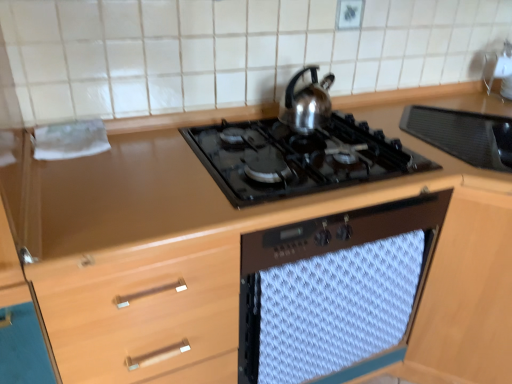
You are a GUI agent. You are given a task and a screenshot of the screen. Output one action in this format:
    pyautogui.click(x=<x>, y=<y>)
    Task: Click on the satin silver kettle at upper center
    This screenshot has width=512, height=384.
    Given the screenshot: What is the action you would take?
    pyautogui.click(x=307, y=103)

How different are the orientations of black glass gas stove at center and white textured towel at center in degrees?

0.00116 degrees separate the facing orientations of black glass gas stove at center and white textured towel at center.

Can you confirm if black glass gas stove at center is smaller than white textured towel at center?

Incorrect, black glass gas stove at center is not smaller in size than white textured towel at center.

Which of these two, black glass gas stove at center or white textured towel at center, is wider?

black glass gas stove at center.

Which is more to the left, white textured towel at center or satin silver kettle at upper center?

satin silver kettle at upper center.

From a real-world perspective, is white textured towel at center below satin silver kettle at upper center?

Yes, from a real-world perspective, white textured towel at center is under satin silver kettle at upper center.

Is white textured towel at center located outside satin silver kettle at upper center?

That's correct, white textured towel at center is outside of satin silver kettle at upper center.

In order to click on kitchen appliance on the left side of white textured towel at center in this screenshot , I will do `click(307, 103)`.

From the image's perspective, between satin silver kettle at upper center and white textured towel at center, which one is located above?

satin silver kettle at upper center is shown above in the image.

Consider the image. How distant is satin silver kettle at upper center from white textured towel at center?

satin silver kettle at upper center and white textured towel at center are 18.82 inches apart.

In terms of width, does satin silver kettle at upper center look wider or thinner when compared to white textured towel at center?

satin silver kettle at upper center is wider than white textured towel at center.

Is black glass gas stove at center oriented away from satin silver kettle at upper center?

No, black glass gas stove at center is not facing away from satin silver kettle at upper center.

Between black glass gas stove at center and satin silver kettle at upper center, which one has larger size?

black glass gas stove at center is bigger.

What's the angular difference between black glass gas stove at center and satin silver kettle at upper center's facing directions?

black glass gas stove at center and satin silver kettle at upper center are facing 0.00112 degrees away from each other.

Which object is closer to the camera taking this photo, black glass gas stove at center or satin silver kettle at upper center?

black glass gas stove at center is in front.

Consider the image. From a real-world perspective, is satin silver kettle at upper center above or below black glass gas stove at center?

satin silver kettle at upper center is above black glass gas stove at center.

Is satin silver kettle at upper center thinner than black glass gas stove at center?

Yes.

Is satin silver kettle at upper center touching black glass gas stove at center?

They are not placed beside each other.

The image size is (512, 384). What are the coordinates of `oven to the right of black glass gas stove at center` in the screenshot? It's located at (335, 291).

Consider the image. From a real-world perspective, does white textured towel at center stand above black glass gas stove at center?

No.

Are white textured towel at center and black glass gas stove at center located far from each other?

No, white textured towel at center is in close proximity to black glass gas stove at center.

Between white textured towel at center and black glass gas stove at center, which one appears on the right side from the viewer's perspective?

white textured towel at center is more to the right.

You are a GUI agent. You are given a task and a screenshot of the screen. Output one action in this format:
    pyautogui.click(x=<x>, y=<y>)
    Task: Click on the oven behind the black glass gas stove at center
    
    Given the screenshot: What is the action you would take?
    point(335,291)

Where is `oven below the satin silver kettle at upper center (from the image's perspective)`? The width and height of the screenshot is (512, 384). oven below the satin silver kettle at upper center (from the image's perspective) is located at coordinates 335,291.

Estimate the real-world distances between objects in this image. Which object is further from white textured towel at center, satin silver kettle at upper center or black glass gas stove at center?

satin silver kettle at upper center is further to white textured towel at center.

Based on their spatial positions, is white textured towel at center or black glass gas stove at center further from satin silver kettle at upper center?

Among the two, white textured towel at center is located further to satin silver kettle at upper center.

Estimate the real-world distances between objects in this image. Which object is closer to white textured towel at center, black glass gas stove at center or satin silver kettle at upper center?

black glass gas stove at center is positioned closer to the anchor white textured towel at center.

From the image, which object appears to be farther from satin silver kettle at upper center, black glass gas stove at center or white textured towel at center?

white textured towel at center is positioned further to the anchor satin silver kettle at upper center.

When comparing their distances from black glass gas stove at center, does white textured towel at center or satin silver kettle at upper center seem further?

Based on the image, white textured towel at center appears to be further to black glass gas stove at center.

From the image, which object appears to be nearer to black glass gas stove at center, satin silver kettle at upper center or white textured towel at center?

satin silver kettle at upper center.

Where is `gas stove that lies between satin silver kettle at upper center and white textured towel at center from top to bottom`? The width and height of the screenshot is (512, 384). gas stove that lies between satin silver kettle at upper center and white textured towel at center from top to bottom is located at coordinates (297, 158).